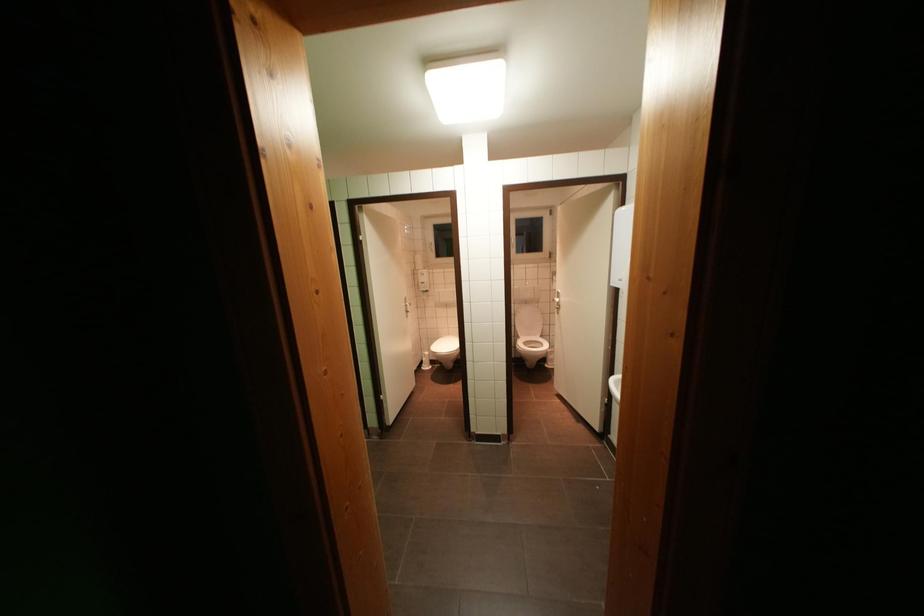
Locate an element on the screen. Image resolution: width=924 pixels, height=616 pixels. white toilet seat is located at coordinates (444, 344).